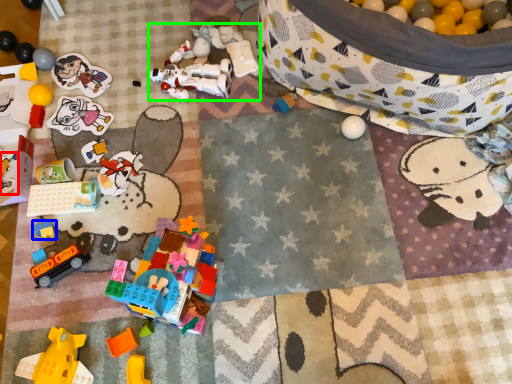
Question: Which object is the farthest from toy (highlighted by a red box)? Choose among these: toy (highlighted by a blue box) or toy (highlighted by a green box).

Choices:
 (A) toy
 (B) toy

Answer: (B)